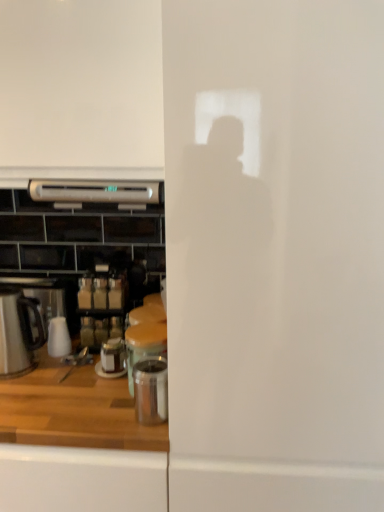
Question: Which direction should I rotate to look at satin silver microwave at upper center, marked as the second kitchen appliance in a bottom-to-top arrangement, — up or down?

Choices:
 (A) down
 (B) up

Answer: (B)

Question: From the image's perspective, is metallic silver canister at center, positioned as the 2th appliance in back-to-front order, on top of stainless steel kettle at left, marked as the 2th kitchen appliance in a top-to-bottom arrangement?

Choices:
 (A) no
 (B) yes

Answer: (A)

Question: Can you see metallic silver canister at center, positioned as the 2th appliance in back-to-front order, touching stainless steel kettle at left, which is the 1th kitchen appliance in left-to-right order?

Choices:
 (A) no
 (B) yes

Answer: (A)

Question: Can you confirm if metallic silver canister at center, which is counted as the second appliance, starting from the front, is thinner than stainless steel kettle at left, placed as the 2th kitchen appliance when sorted from right to left?

Choices:
 (A) yes
 (B) no

Answer: (A)

Question: Are metallic silver canister at center, which is counted as the second appliance, starting from the front, and stainless steel kettle at left, marked as the 2th kitchen appliance in a top-to-bottom arrangement, located far from each other?

Choices:
 (A) yes
 (B) no

Answer: (B)

Question: Considering the relative sizes of metallic silver canister at center, positioned as the 2th appliance in back-to-front order, and stainless steel kettle at left, placed as the 2th kitchen appliance when sorted from right to left, in the image provided, is metallic silver canister at center, positioned as the 2th appliance in back-to-front order, smaller than stainless steel kettle at left, placed as the 2th kitchen appliance when sorted from right to left,?

Choices:
 (A) yes
 (B) no

Answer: (A)

Question: Is the depth of metallic silver canister at center, positioned as the 2th appliance in back-to-front order, greater than that of stainless steel kettle at left, placed as the 2th kitchen appliance when sorted from right to left?

Choices:
 (A) yes
 (B) no

Answer: (B)

Question: Could you tell me if metallic silver canister at center, positioned as the 2th appliance in back-to-front order, is turned towards white glossy microwave at upper left?

Choices:
 (A) no
 (B) yes

Answer: (A)

Question: From the image's perspective, is metallic silver canister at center, which is counted as the second appliance, starting from the front, below white glossy microwave at upper left?

Choices:
 (A) yes
 (B) no

Answer: (A)

Question: Is metallic silver canister at center, positioned as the 2th appliance in back-to-front order, shorter than white glossy microwave at upper left?

Choices:
 (A) no
 (B) yes

Answer: (B)

Question: Is metallic silver canister at center, which is counted as the second appliance, starting from the front, closer to camera compared to white glossy microwave at upper left?

Choices:
 (A) no
 (B) yes

Answer: (A)

Question: Is metallic silver canister at center, which is counted as the second appliance, starting from the front, next to white glossy microwave at upper left?

Choices:
 (A) yes
 (B) no

Answer: (B)

Question: Does metallic silver canister at center, positioned as the 2th appliance in back-to-front order, have a smaller size compared to white glossy microwave at upper left?

Choices:
 (A) yes
 (B) no

Answer: (A)

Question: Is stainless steel kettle at left, placed as the 2th kitchen appliance when sorted from right to left, in front of polished stainless steel container at lower center, which is the 1th appliance from front to back?

Choices:
 (A) yes
 (B) no

Answer: (B)